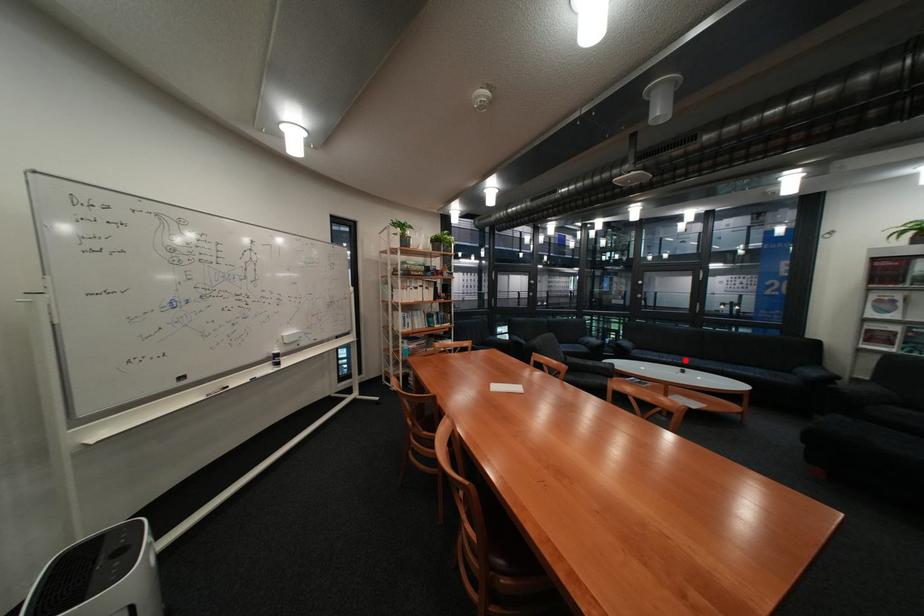
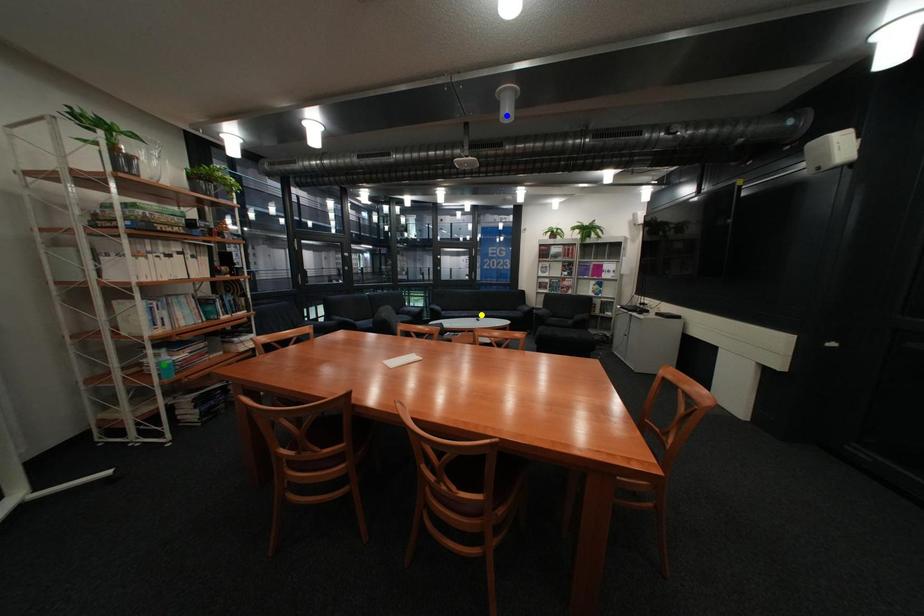
Question: I am providing you with two images of the same scene from different viewpoints. A red point is marked on the first image. You are given multiple points on the second image. Which mark in image 2 goes with the point in image 1?

Choices:
 (A) yellow point
 (B) blue point
 (C) green point

Answer: (A)